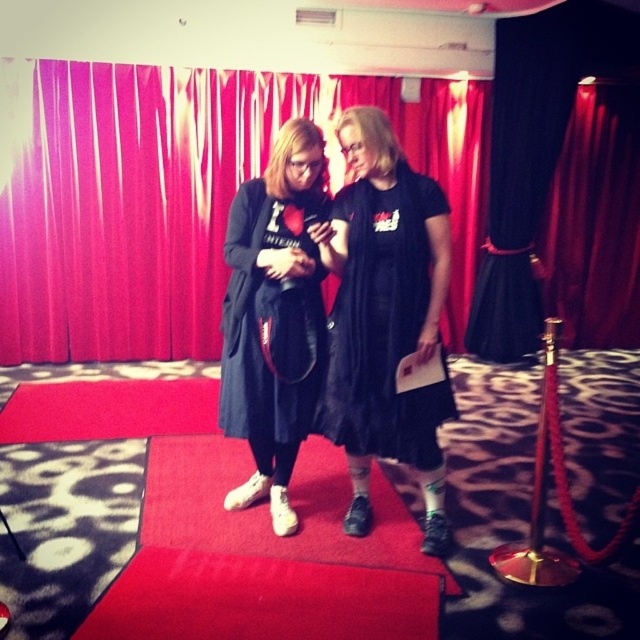
You are a fashion designer observing the scene. There are two people wearing a matte black dress at center and a black matte dress at center. Which one has a larger size?

The matte black dress at center has a larger size compared to the black matte dress at center.

You are a stagehand who needs to set up a microphone stand between the red velvet curtain at center and the black matte dress at center. The microphone stand requires a minimum of 10 feet of space between the two objects to be placed safely. Based on the description, can you safely place the microphone stand between them?

The red velvet curtain at center is 9.99 feet from the black matte dress at center. Since the required minimum space is 10 feet, the distance is insufficient. Therefore, the microphone stand cannot be placed safely between them.

You are a photographer at an event and need to adjust the lighting so that the matte black dress at center is visible without the red velvet curtain at center casting a shadow on it. Based on their positions, is this possible?

The red velvet curtain at center is positioned over matte black dress at center, so adjusting the lighting to avoid the curtain casting a shadow might be challenging. The curtain is likely blocking direct light, making it difficult to illuminate the dress without shadow.